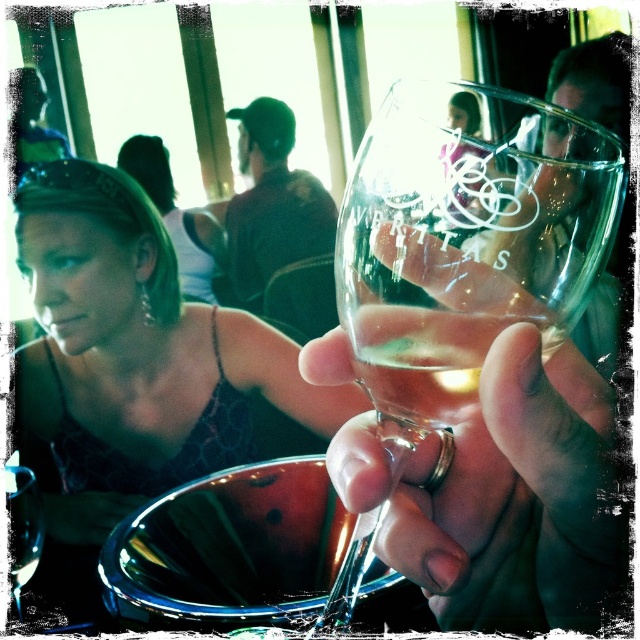
You are at a wine tasting event and want to place a small note on the table next to the transparent glass wine glass at center. The table coordinates are from point A at 0.25 to point B at 0.4 on the x and y axis. Can you place the note there without it being under the glass?

The transparent glass wine glass at center is located at point (465,241). The table coordinates are from point A at 0.25 to point B at 0.4. Since the glass is at 0.378 which is within the table area, placing the note next to it would require positioning it outside the glass area. However, since the glass is at the edge of the table coordinates, there might not be enough space. The note cannot be placed without overlapping the glass.

You are at a wine tasting event and want to pour a full glass of wine. You have two wine glasses in front of you, the transparent glass wine glass at center and the clear glass wine glass at center. Which glass should you choose if you want to hold more wine?

The transparent glass wine glass at center is bigger than the clear glass wine glass at center, so you should choose the transparent glass wine glass at center to hold more wine.